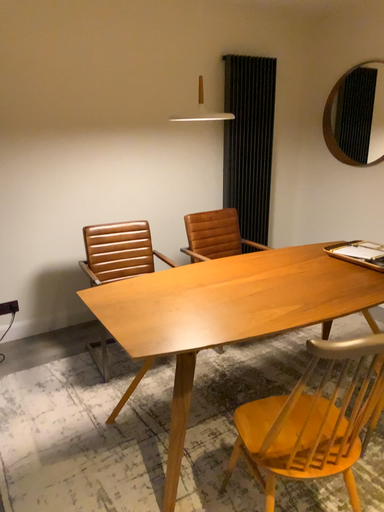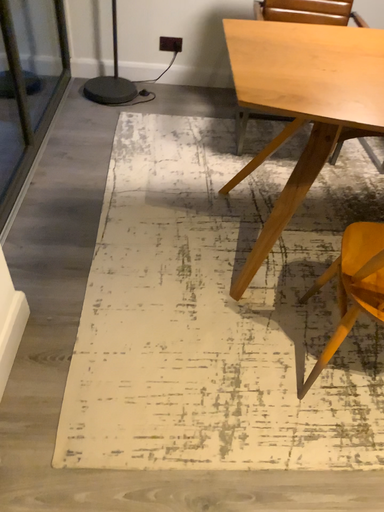
Question: How did the camera likely rotate when shooting the video?

Choices:
 (A) rotated right
 (B) rotated left

Answer: (B)